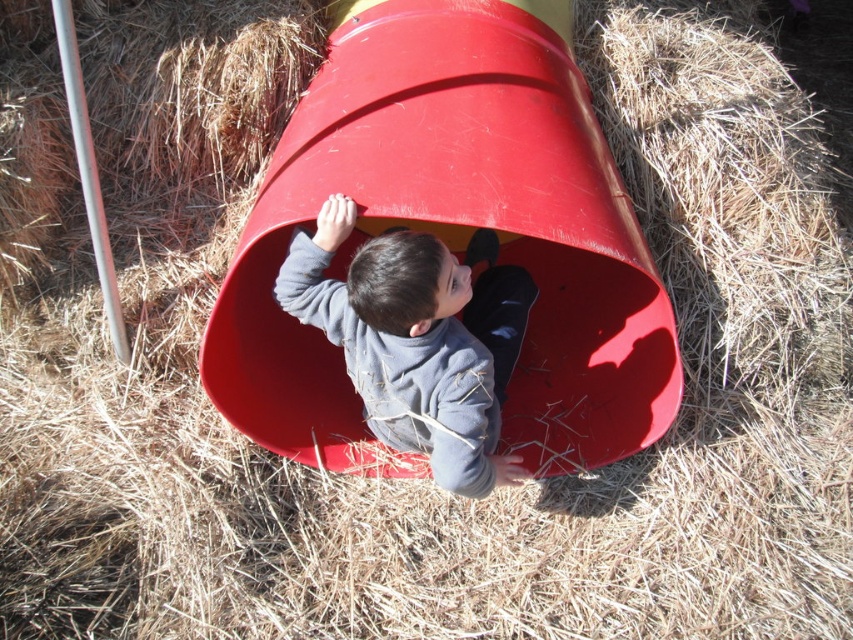
Question: Does smooth plastic slide at center come behind matte gray sweater at center?

Choices:
 (A) no
 (B) yes

Answer: (A)

Question: Is smooth plastic slide at center bigger than matte gray sweater at center?

Choices:
 (A) yes
 (B) no

Answer: (A)

Question: Which point is farther from the camera taking this photo?

Choices:
 (A) (350, 272)
 (B) (556, 84)

Answer: (B)

Question: Considering the relative positions of smooth plastic slide at center and matte gray sweater at center in the image provided, where is smooth plastic slide at center located with respect to matte gray sweater at center?

Choices:
 (A) right
 (B) left

Answer: (A)

Question: Which object is farther from the camera taking this photo?

Choices:
 (A) matte gray sweater at center
 (B) smooth plastic slide at center

Answer: (A)